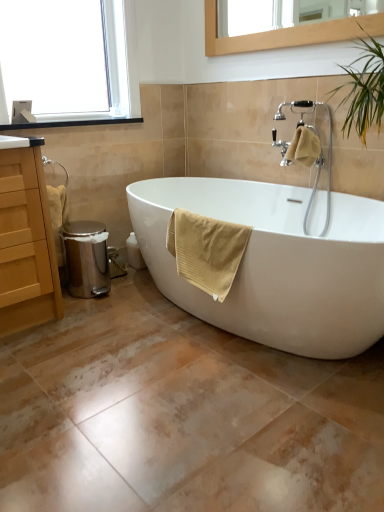
Find the location of a particular element. vacant space in front of matte wood cabinet at left is located at coordinates (31, 351).